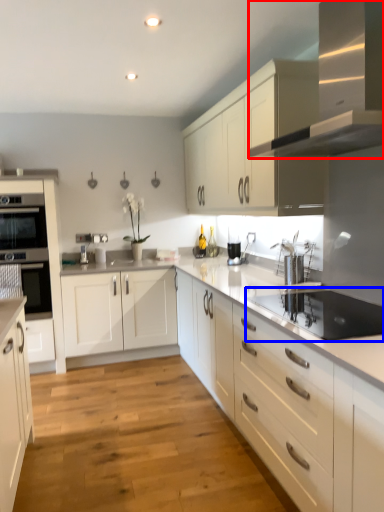
Question: Which object is further to the camera taking this photo, home appliance (highlighted by a red box) or appliance (highlighted by a blue box)?

Choices:
 (A) home appliance
 (B) appliance

Answer: (B)